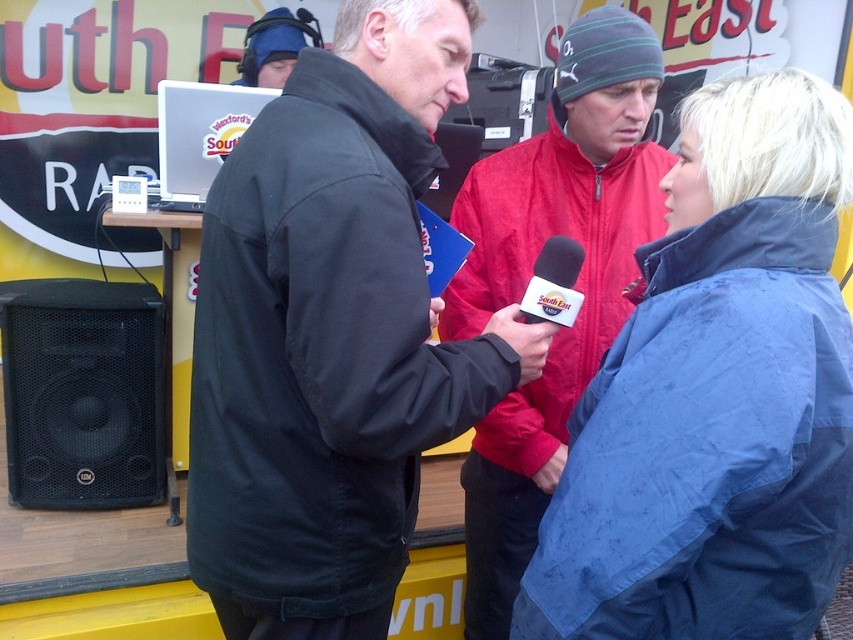
Is black matte jacket at center to the left of matte blue glove at lower right from the viewer's perspective?

Indeed, black matte jacket at center is positioned on the left side of matte blue glove at lower right.

Is black matte jacket at center shorter than matte blue glove at lower right?

Incorrect, black matte jacket at center's height does not fall short of matte blue glove at lower right's.

Identify the location of black matte jacket at center. (320, 353).

This screenshot has width=853, height=640. Find the location of `black matte jacket at center`. black matte jacket at center is located at coordinates (320, 353).

Can you confirm if red fleece jacket at center is smaller than black matte speaker at lower left?

No, red fleece jacket at center is not smaller than black matte speaker at lower left.

Which is more to the right, red fleece jacket at center or black matte speaker at lower left?

Positioned to the right is red fleece jacket at center.

Measure the distance between red fleece jacket at center and camera.

They are 5.13 feet apart.

You are a GUI agent. You are given a task and a screenshot of the screen. Output one action in this format:
    pyautogui.click(x=<x>, y=<y>)
    Task: Click on the red fleece jacket at center
    The width and height of the screenshot is (853, 640).
    Given the screenshot: What is the action you would take?
    pyautogui.click(x=531, y=273)

Is black matte speaker at lower left to the left of matte blue glove at lower right from the viewer's perspective?

Yes, black matte speaker at lower left is to the left of matte blue glove at lower right.

Does black matte speaker at lower left appear on the right side of matte blue glove at lower right?

No, black matte speaker at lower left is not to the right of matte blue glove at lower right.

Where is `black matte speaker at lower left`? This screenshot has width=853, height=640. black matte speaker at lower left is located at coordinates (82, 394).

Identify the location of black matte speaker at lower left. The width and height of the screenshot is (853, 640). (82, 394).